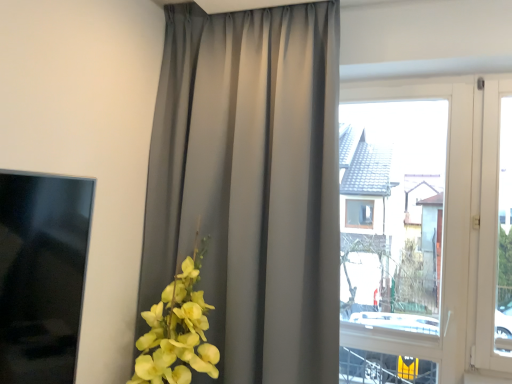
Question: Is transparent glass window at center oriented away from satin gray curtain at center?

Choices:
 (A) yes
 (B) no

Answer: (B)

Question: Does transparent glass window at center lie behind satin gray curtain at center?

Choices:
 (A) yes
 (B) no

Answer: (A)

Question: Is transparent glass window at center positioned far away from satin gray curtain at center?

Choices:
 (A) yes
 (B) no

Answer: (B)

Question: Is transparent glass window at center bigger than satin gray curtain at center?

Choices:
 (A) yes
 (B) no

Answer: (B)

Question: Is satin gray curtain at center surrounded by transparent glass window at center?

Choices:
 (A) no
 (B) yes

Answer: (A)

Question: From the image's perspective, is transparent glass window at center located beneath satin gray curtain at center?

Choices:
 (A) no
 (B) yes

Answer: (B)

Question: Can you confirm if satin gray curtain at center is thinner than transparent glass window at center?

Choices:
 (A) yes
 (B) no

Answer: (B)

Question: Does satin gray curtain at center turn towards transparent glass window at center?

Choices:
 (A) yes
 (B) no

Answer: (B)

Question: Is satin gray curtain at center at the right side of transparent glass window at center?

Choices:
 (A) no
 (B) yes

Answer: (A)

Question: Does satin gray curtain at center have a lesser height compared to transparent glass window at center?

Choices:
 (A) yes
 (B) no

Answer: (B)

Question: Is satin gray curtain at center next to transparent glass window at center and touching it?

Choices:
 (A) no
 (B) yes

Answer: (A)

Question: Is satin gray curtain at center bigger than transparent glass window at center?

Choices:
 (A) yes
 (B) no

Answer: (A)

Question: From their relative heights in the image, would you say satin gray curtain at center is taller or shorter than transparent glass window at center?

Choices:
 (A) short
 (B) tall

Answer: (B)